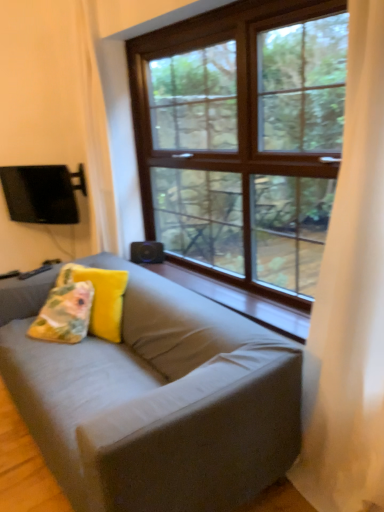
Question: Does point (137, 254) appear closer or farther from the camera than point (64, 264)?

Choices:
 (A) closer
 (B) farther

Answer: (B)

Question: In terms of height, does black matte speaker at center look taller or shorter compared to yellow fabric pillow at center, the first pillow when ordered from right to left?

Choices:
 (A) short
 (B) tall

Answer: (A)

Question: Based on their relative distances, which object is nearer to the wooden at center?

Choices:
 (A) black matte speaker at center
 (B) floral fabric pillow at lower left, positioned as the 2th pillow in right-to-left order
 (C) white sheer curtain at right
 (D) yellow fabric pillow at center, positioned as the second pillow in left-to-right order
 (E) matte gray couch at center

Answer: (E)

Question: Estimate the real-world distances between objects in this image. Which object is closer to the black matte speaker at center?

Choices:
 (A) matte gray couch at center
 (B) white sheer curtain at right
 (C) wooden at center
 (D) floral fabric pillow at lower left, positioned as the 2th pillow in right-to-left order
 (E) yellow fabric pillow at center, the first pillow when ordered from right to left

Answer: (C)